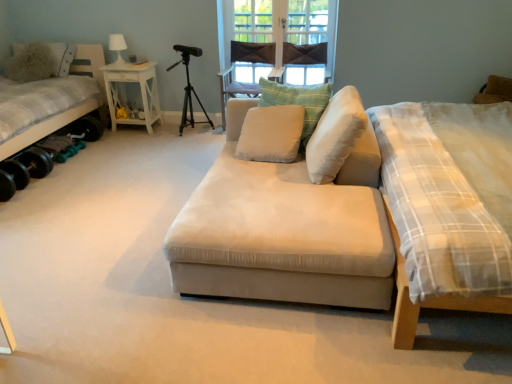
Question: Considering the relative sizes of white wood side table at left and plaid fabric mattress at right in the image provided, is white wood side table at left thinner than plaid fabric mattress at right?

Choices:
 (A) no
 (B) yes

Answer: (B)

Question: Can you confirm if white wood side table at left is taller than plaid fabric mattress at right?

Choices:
 (A) yes
 (B) no

Answer: (B)

Question: Is white wood side table at left behind plaid fabric mattress at right?

Choices:
 (A) yes
 (B) no

Answer: (A)

Question: From a real-world perspective, is white wood side table at left physically above plaid fabric mattress at right?

Choices:
 (A) no
 (B) yes

Answer: (A)

Question: Can you confirm if white wood side table at left is positioned to the left of plaid fabric mattress at right?

Choices:
 (A) yes
 (B) no

Answer: (A)

Question: Is point (32, 74) positioned closer to the camera than point (359, 117)?

Choices:
 (A) closer
 (B) farther

Answer: (B)

Question: Based on their positions, is fuzzy fabric pillow at upper left, marked as the 1th pillow in a left-to-right arrangement, located to the left or right of white soft cushion at center, which is counted as the 1th pillow, starting from the front?

Choices:
 (A) right
 (B) left

Answer: (B)

Question: Choose the correct answer: Is fuzzy fabric pillow at upper left, marked as the 4th pillow in a right-to-left arrangement, inside white soft cushion at center, which appears as the 4th pillow when viewed from the back, or outside it?

Choices:
 (A) outside
 (B) inside

Answer: (A)

Question: From their relative heights in the image, would you say fuzzy fabric pillow at upper left, marked as the 1th pillow in a left-to-right arrangement, is taller or shorter than white soft cushion at center, which appears as the 4th pillow when viewed from the back?

Choices:
 (A) tall
 (B) short

Answer: (A)

Question: From a real-world perspective, is beige fabric couch at center physically located above or below white fabric bed at left?

Choices:
 (A) above
 (B) below

Answer: (B)

Question: Considering the relative positions of beige fabric couch at center and white fabric bed at left in the image provided, is beige fabric couch at center to the left or to the right of white fabric bed at left?

Choices:
 (A) left
 (B) right

Answer: (B)

Question: Does point (250, 190) appear closer or farther from the camera than point (89, 57)?

Choices:
 (A) farther
 (B) closer

Answer: (B)

Question: Based on their sizes in the image, would you say beige fabric couch at center is bigger or smaller than white fabric bed at left?

Choices:
 (A) big
 (B) small

Answer: (B)

Question: Is white soft cushion at center, which is counted as the 1th pillow, starting from the front, wider or thinner than light beige fabric armchair at center?

Choices:
 (A) thin
 (B) wide

Answer: (A)

Question: Considering their positions, is white soft cushion at center, which appears as the 4th pillow when viewed from the back, located in front of or behind light beige fabric armchair at center?

Choices:
 (A) behind
 (B) front

Answer: (B)